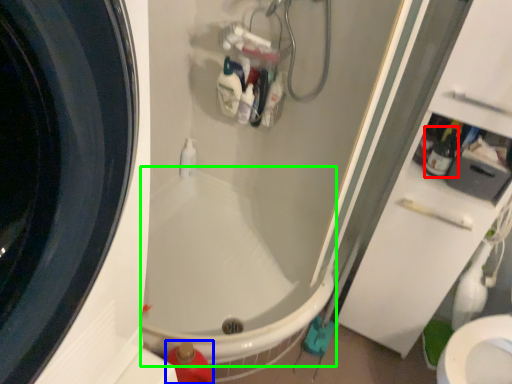
Question: Based on their relative distances, which object is farther from bottle (highlighted by a red box)? Choose from cleaning product (highlighted by a blue box) and bath (highlighted by a green box).

Choices:
 (A) cleaning product
 (B) bath

Answer: (A)